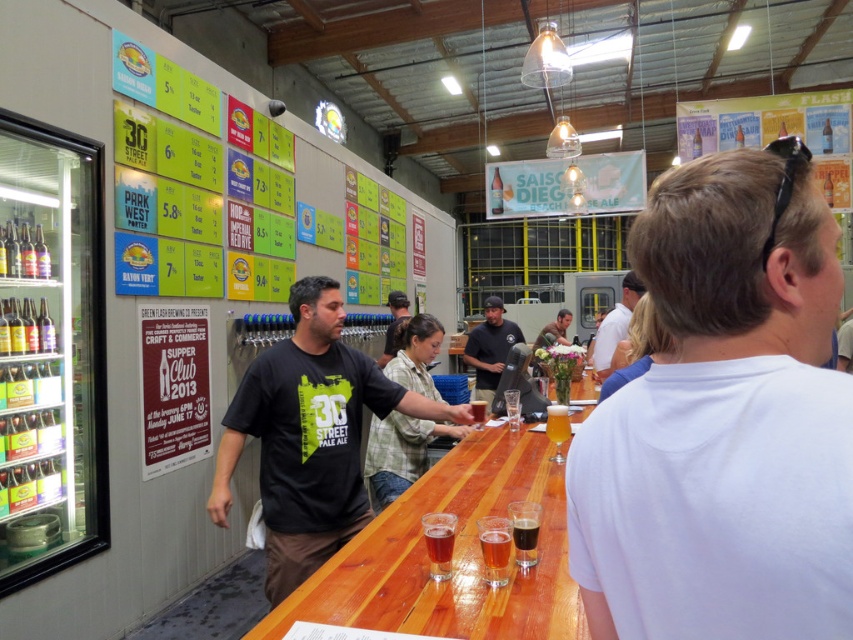
You are standing at the entrance of the taproom and notice two points marked on the floor. The first point is at coordinate point (630, 289) and the second is at point (566, 321). Which point is closer to you as you face the bar counter?

Point (630, 289) is in front of point (566, 321), so the first point is closer to you as you face the bar counter.

You are a bartender at the brewery and need to place a 12 inch tall beer stein between the white cotton shirt at center and the matte black shirt at center. Which shirt should you place it closer to based on their heights?

The white cotton shirt at center is taller than the matte black shirt at center, so the beer stein should be placed closer to the white cotton shirt at center to maintain balance.